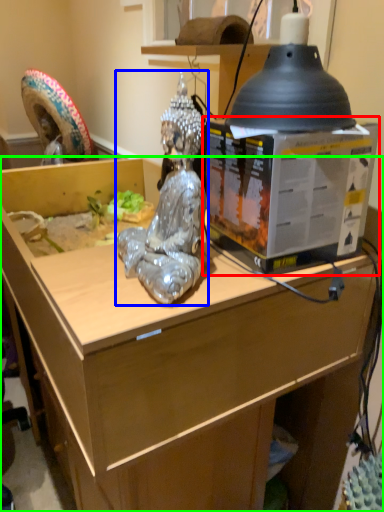
Question: Which object is positioned farthest from box (highlighted by a red box)? Select from person (highlighted by a blue box) and desk (highlighted by a green box).

Choices:
 (A) person
 (B) desk

Answer: (B)